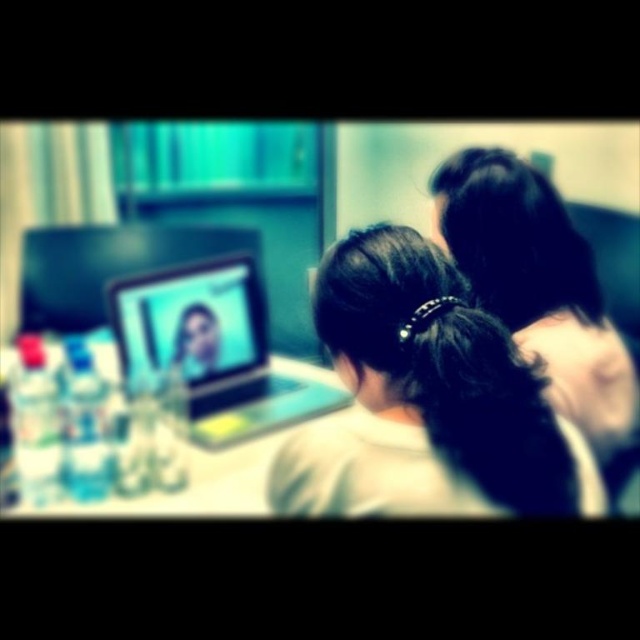
Does dark brown hair at center have a greater height compared to teal glossy laptop at center?

Yes.

In the scene shown: Is dark brown hair at center below teal glossy laptop at center?

Yes.

Who is more forward, (333,477) or (273,358)?

Point (333,477)

The width and height of the screenshot is (640, 640). What are the coordinates of `dark brown hair at center` in the screenshot? It's located at (426, 401).